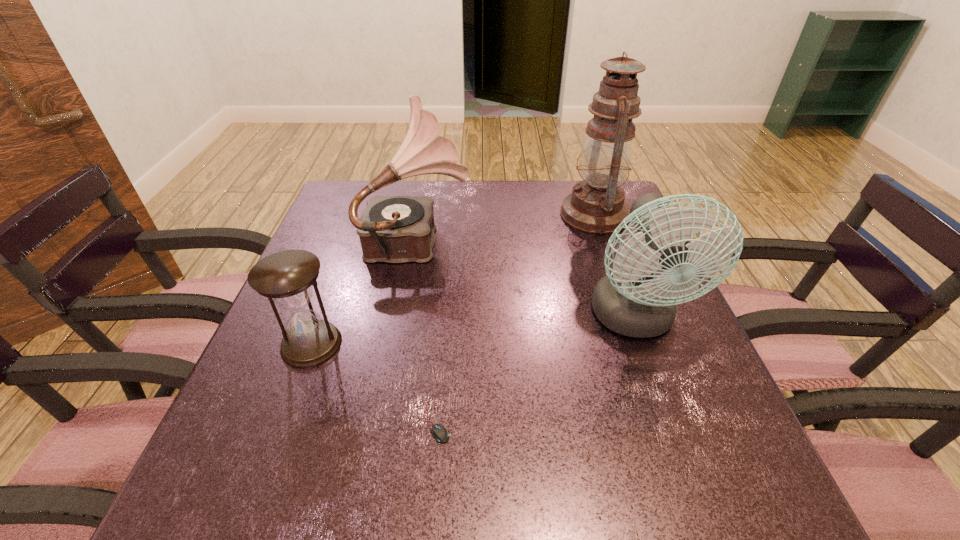
The height and width of the screenshot is (540, 960). Find the location of `blank area located on the left of the nearest object`. blank area located on the left of the nearest object is located at coordinates (241, 423).

In order to click on oil lamp that is at the far edge in this screenshot , I will do `click(596, 205)`.

Where is `record player situated at the far edge`? This screenshot has width=960, height=540. record player situated at the far edge is located at coordinates (396, 229).

Locate an element on the screen. record player that is at the left edge is located at coordinates pyautogui.click(x=396, y=229).

The image size is (960, 540). In order to click on hourglass that is at the left edge in this screenshot , I will do `click(286, 277)`.

Find the location of a particular element. The height and width of the screenshot is (540, 960). oil lamp positioned at the right edge is located at coordinates (596, 205).

At what (x,y) coordinates should I click in order to perform the action: click on fan present at the right edge. Please return your answer as a coordinate pair (x, y). This screenshot has height=540, width=960. Looking at the image, I should click on (631, 301).

The image size is (960, 540). Identify the location of object situated at the far left corner. (396, 229).

Locate an element on the screen. object that is at the far right corner is located at coordinates (596, 205).

In the image, there is a desktop. At what (x,y) coordinates should I click in order to perform the action: click on blank space at the far edge. Please return your answer as a coordinate pair (x, y). Image resolution: width=960 pixels, height=540 pixels. Looking at the image, I should click on (453, 200).